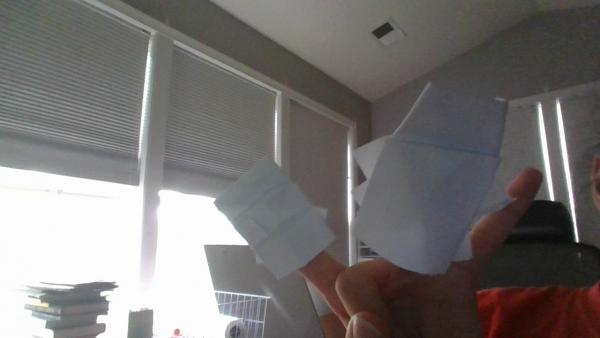
Image resolution: width=600 pixels, height=338 pixels. Find the location of `gray wall`. gray wall is located at coordinates (529, 56).